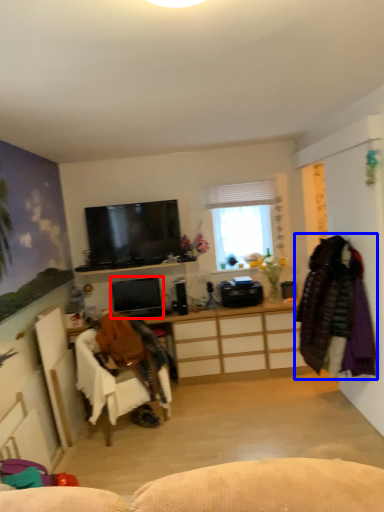
Question: Which of the following is the farthest to the observer, television (highlighted by a red box) or clothing (highlighted by a blue box)?

Choices:
 (A) television
 (B) clothing

Answer: (A)